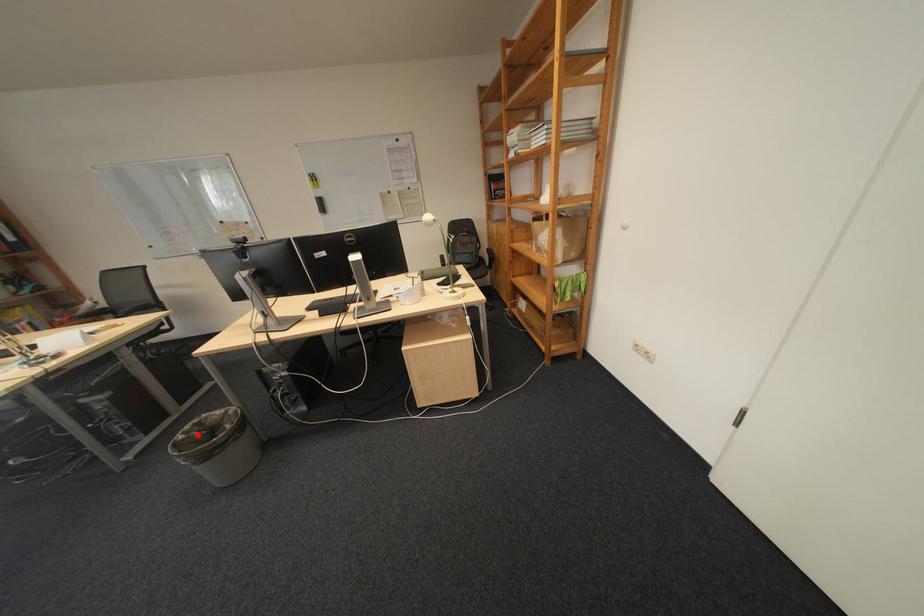
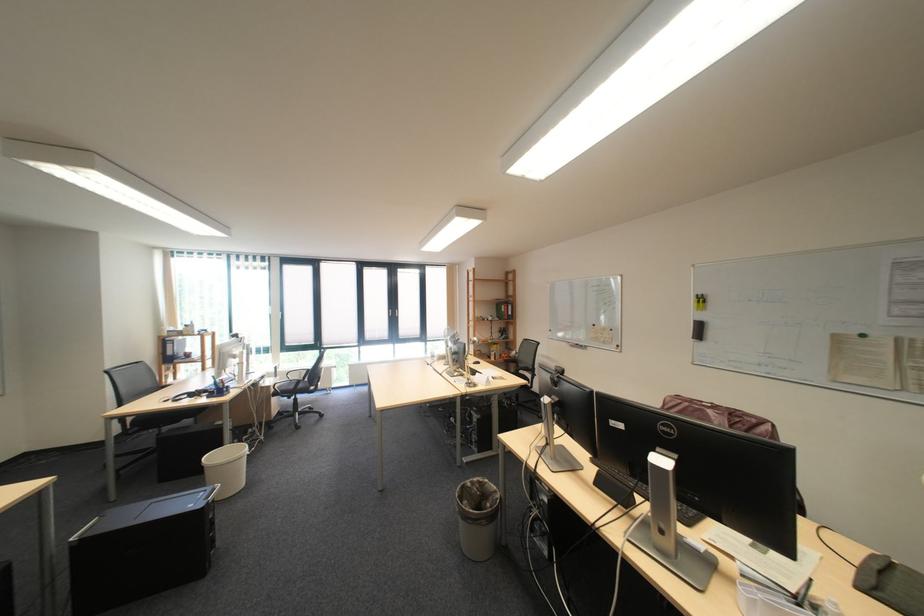
The point at the highlighted location is marked in the first image. Where is the corresponding point in the second image?

(485, 484)